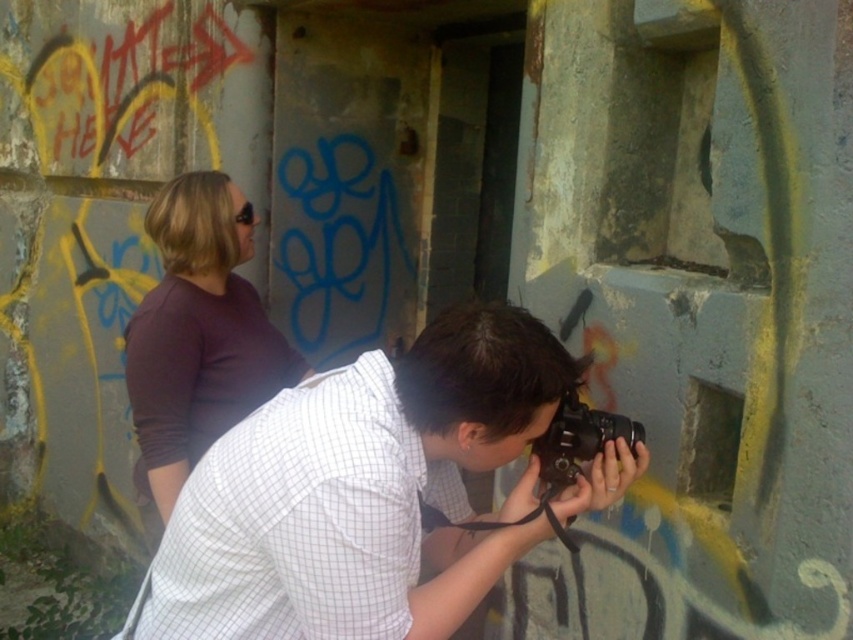
Question: Which point is closer to the camera taking this photo?

Choices:
 (A) (560, 449)
 (B) (180, 200)
 (C) (532, 387)

Answer: (C)

Question: Which object is farther from the camera taking this photo?

Choices:
 (A) black plastic camera at center
 (B) matte purple shirt at upper left

Answer: (B)

Question: Among these objects, which one is farthest from the camera?

Choices:
 (A) white checkered shirt at center
 (B) black plastic camera at center
 (C) matte purple shirt at upper left

Answer: (C)

Question: Can you confirm if matte purple shirt at upper left is smaller than black plastic camera at center?

Choices:
 (A) yes
 (B) no

Answer: (B)

Question: Can you confirm if white checkered shirt at center is wider than matte purple shirt at upper left?

Choices:
 (A) no
 (B) yes

Answer: (B)

Question: Can you confirm if matte purple shirt at upper left is positioned to the left of black plastic camera at center?

Choices:
 (A) yes
 (B) no

Answer: (A)